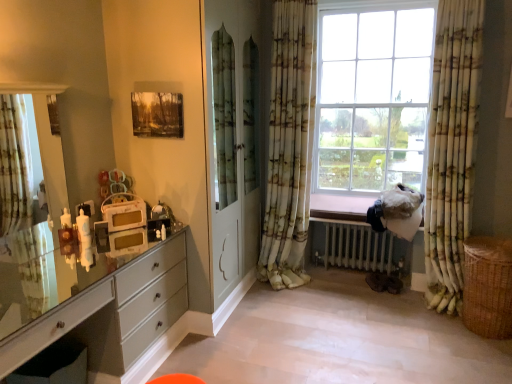
You are a GUI agent. You are given a task and a screenshot of the screen. Output one action in this format:
    pyautogui.click(x=<x>, y=<y>)
    Task: Click on the free spot to the left of braided wicker basket at lower right
    The height and width of the screenshot is (384, 512).
    Given the screenshot: What is the action you would take?
    pyautogui.click(x=434, y=339)